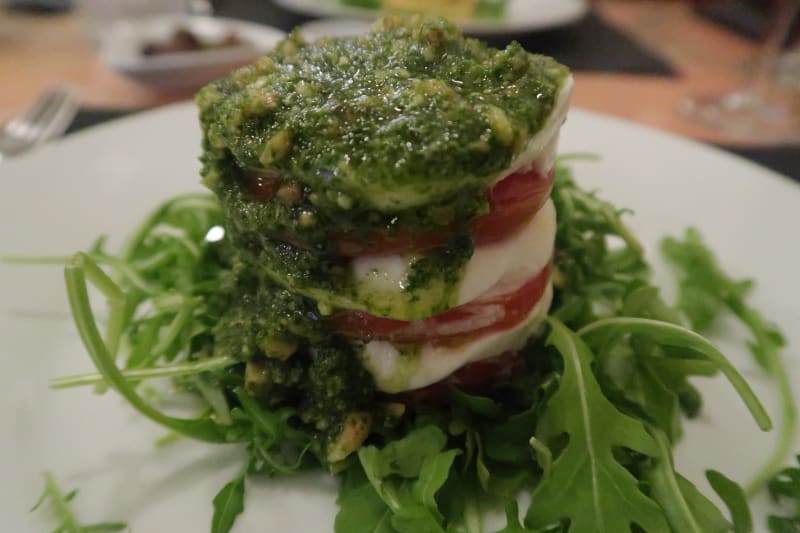
Find the location of a particular element. This screenshot has height=533, width=800. base of wine glass is located at coordinates (722, 113).